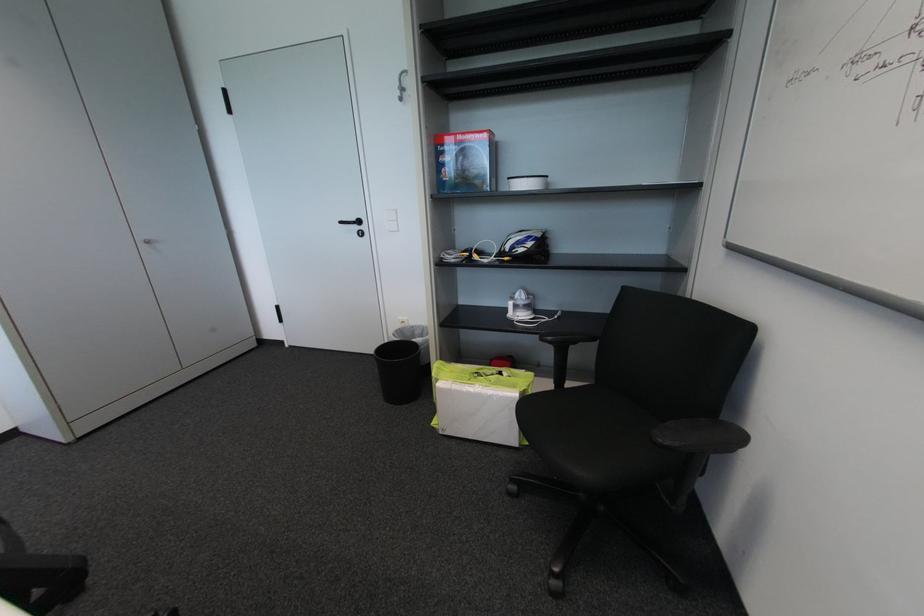
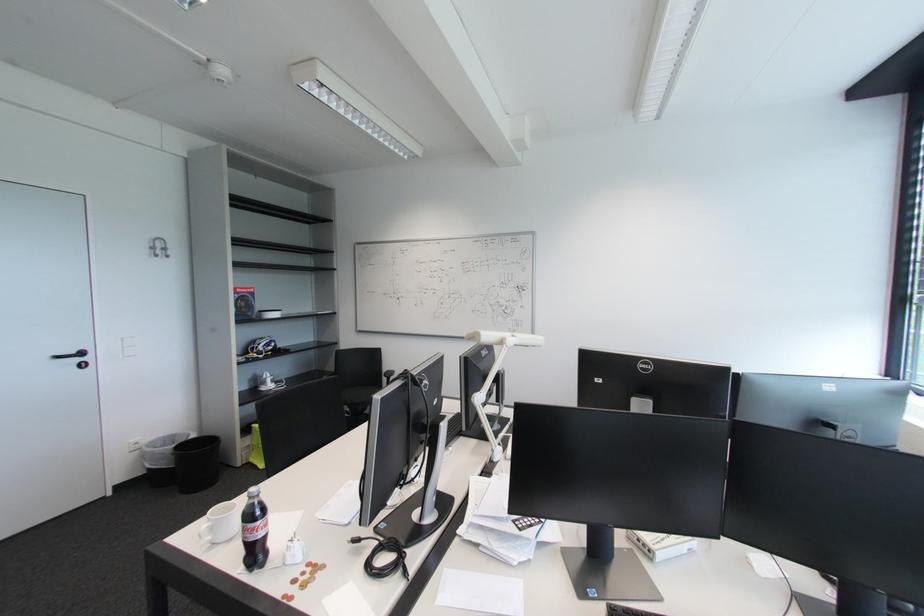
Locate, in the second image, the point that corresponds to point (362, 229) in the first image.

(83, 361)